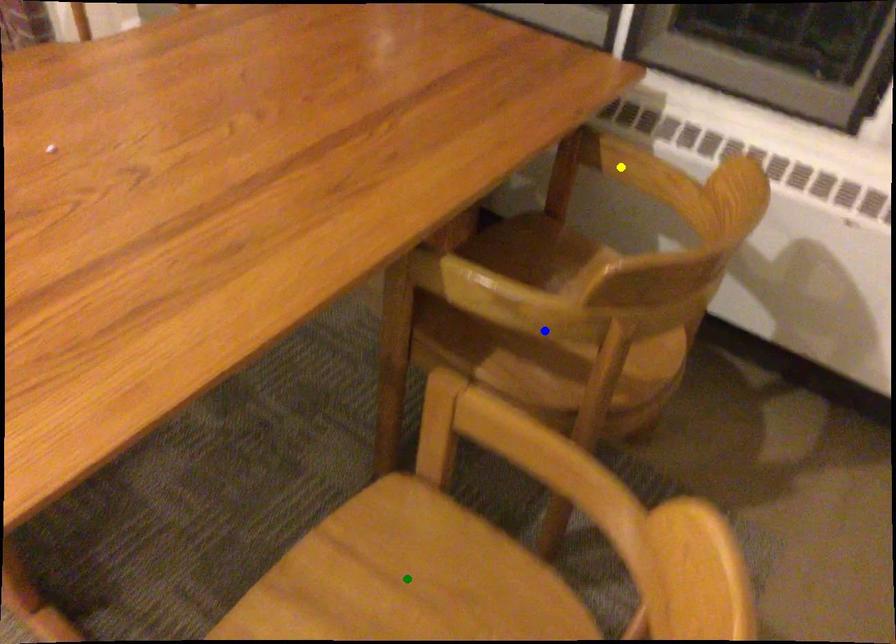
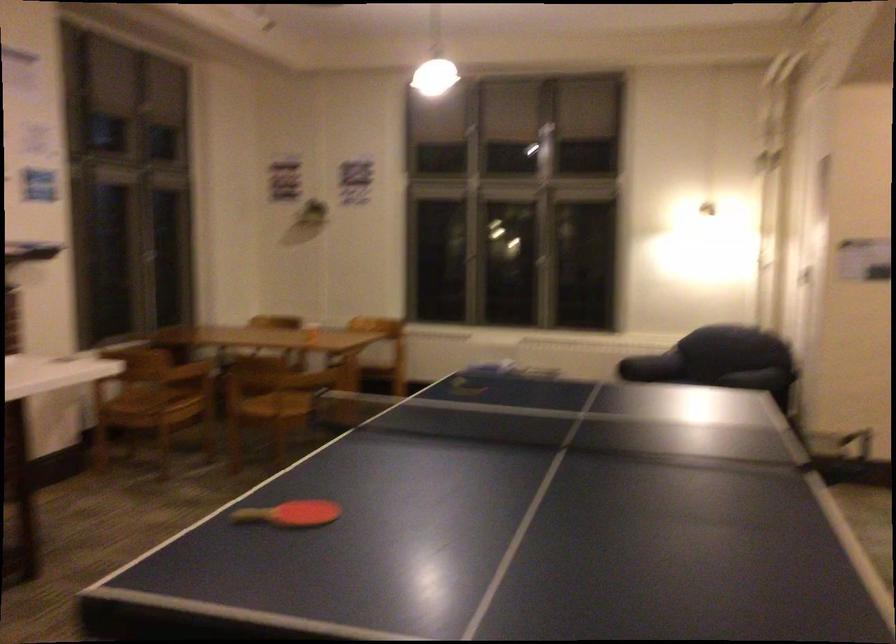
I am providing you with two images of the same scene from different viewpoints. Three points are marked in image1. Which point corresponds to a part or object that is occluded in image2?In image1, three points are marked. Which of them correspond to a part or object that is occluded in image2?Among the three points shown in image1, which one corresponds to a part or object that is no longer visible due to occlusion in image2?

blue point, green point, yellow point